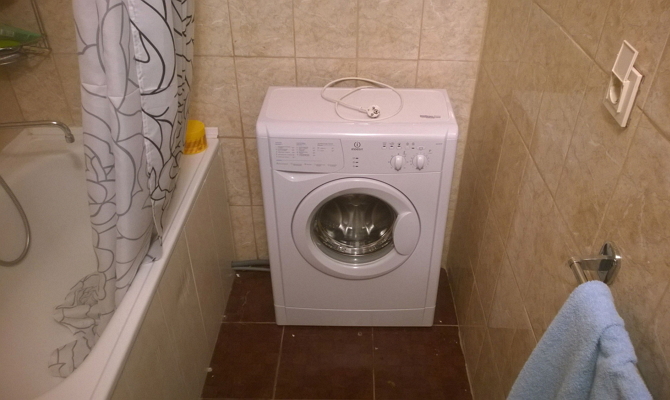
Identify the location of towl rack. This screenshot has width=670, height=400. (585, 259).